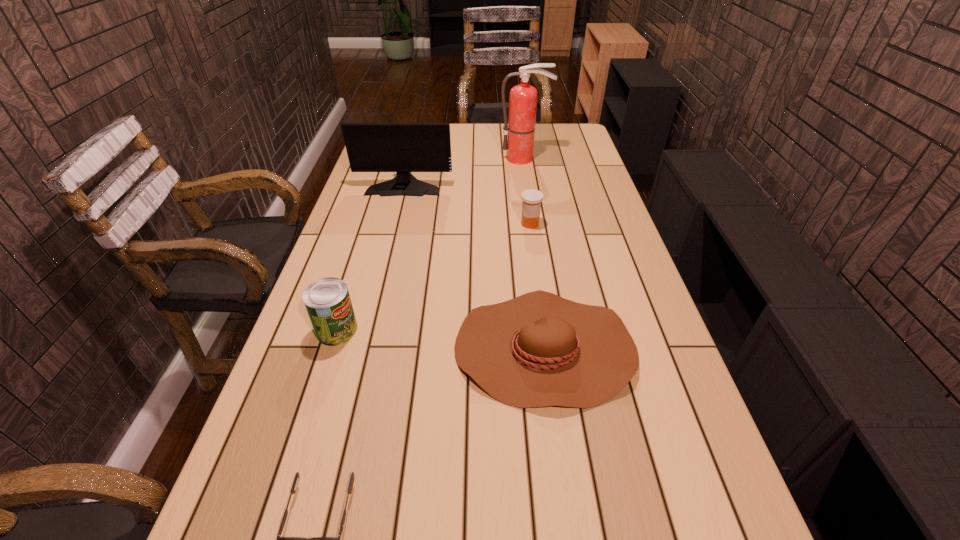
Identify which object is the fifth nearest to the fourth nearest object. Please provide its 2D coordinates. Your answer should be formatted as a tuple, i.e. [(x, y)], where the tuple contains the x and y coordinates of a point satisfying the conditions above.

[(295, 483)]